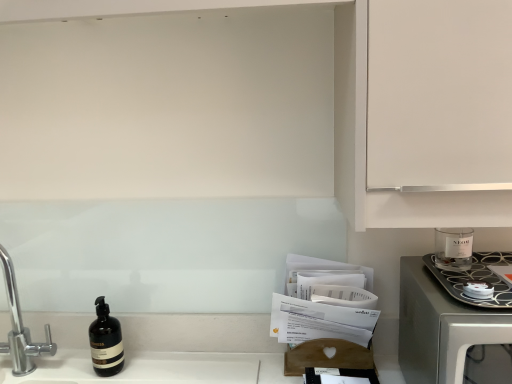
Question: Considering the relative sizes of satin silver microwave at right and chrome metallic faucet at left in the image provided, is satin silver microwave at right thinner than chrome metallic faucet at left?

Choices:
 (A) no
 (B) yes

Answer: (A)

Question: Is satin silver microwave at right at the left side of chrome metallic faucet at left?

Choices:
 (A) no
 (B) yes

Answer: (A)

Question: From the image's perspective, does satin silver microwave at right appear higher than chrome metallic faucet at left?

Choices:
 (A) yes
 (B) no

Answer: (B)

Question: Could you tell me if satin silver microwave at right is turned towards chrome metallic faucet at left?

Choices:
 (A) no
 (B) yes

Answer: (A)

Question: From a real-world perspective, is satin silver microwave at right under chrome metallic faucet at left?

Choices:
 (A) yes
 (B) no

Answer: (A)

Question: Is chrome metallic faucet at left in front of or behind clear glass candle at right in the image?

Choices:
 (A) behind
 (B) front

Answer: (A)

Question: Looking at the image, does chrome metallic faucet at left seem bigger or smaller compared to clear glass candle at right?

Choices:
 (A) small
 (B) big

Answer: (B)

Question: Based on their positions, is chrome metallic faucet at left located to the left or right of clear glass candle at right?

Choices:
 (A) right
 (B) left

Answer: (B)

Question: Looking at their shapes, would you say chrome metallic faucet at left is wider or thinner than clear glass candle at right?

Choices:
 (A) thin
 (B) wide

Answer: (A)

Question: Is satin silver microwave at right inside or outside of chrome metallic faucet at left?

Choices:
 (A) inside
 (B) outside

Answer: (B)

Question: From the image's perspective, relative to chrome metallic faucet at left, is satin silver microwave at right above or below?

Choices:
 (A) above
 (B) below

Answer: (B)

Question: Considering the positions of satin silver microwave at right and chrome metallic faucet at left in the image, is satin silver microwave at right wider or thinner than chrome metallic faucet at left?

Choices:
 (A) thin
 (B) wide

Answer: (B)

Question: Considering the relative positions of satin silver microwave at right and chrome metallic faucet at left in the image provided, is satin silver microwave at right to the left or to the right of chrome metallic faucet at left?

Choices:
 (A) left
 (B) right

Answer: (B)

Question: Considering their positions, is satin silver microwave at right located in front of or behind clear glass candle at right?

Choices:
 (A) behind
 (B) front

Answer: (B)

Question: From the image's perspective, relative to clear glass candle at right, is satin silver microwave at right above or below?

Choices:
 (A) below
 (B) above

Answer: (A)